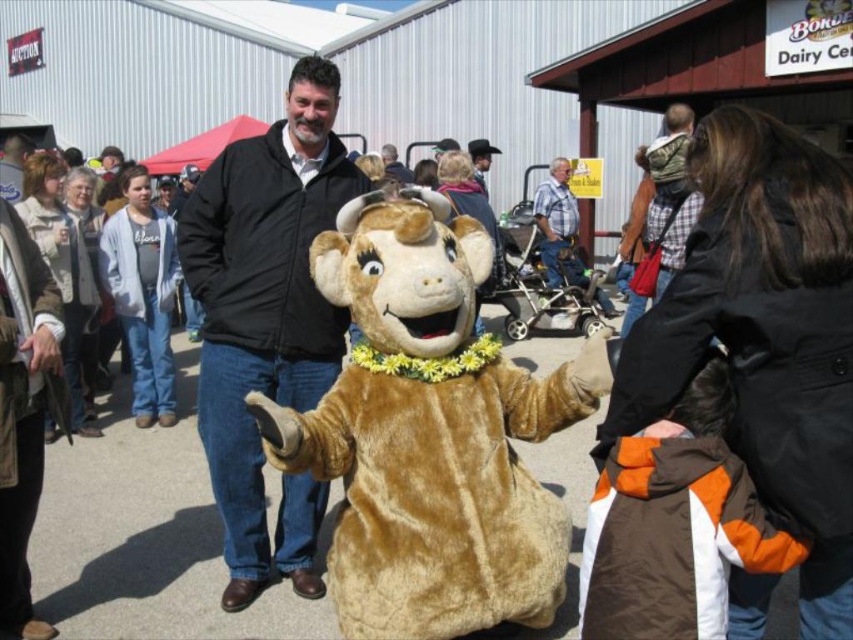
You are a photographer at the event and need to capture a photo that includes both the black softshell jacket at center and the blue plaid shirt at center. What is the minimum distance you need to move backward to ensure both subjects are in frame?

The minimum distance you need to move backward is 6.28 meters to ensure both the black softshell jacket at center and the blue plaid shirt at center are in frame.

You are at the fair and see the black softshell jacket at center and the blue plaid shirt at center. Which clothing item is positioned lower on the person?

The black softshell jacket at center is below the blue plaid shirt at center, so the black softshell jacket at center is positioned lower on the person.

You are a photographer at the fair and want to capture both the fuzzy brown bear at center and the blue plaid shirt at center in the same frame. Which object should you focus on first to ensure both are in the frame?

The fuzzy brown bear at center is shorter than the blue plaid shirt at center, so you should focus on the blue plaid shirt at center first to ensure both are in the frame.